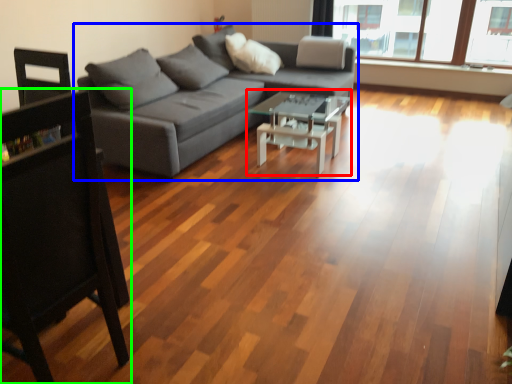
Question: Which object is positioned closest to coffee table (highlighted by a red box)? Select from studio couch (highlighted by a blue box) and chair (highlighted by a green box).

Choices:
 (A) studio couch
 (B) chair

Answer: (A)